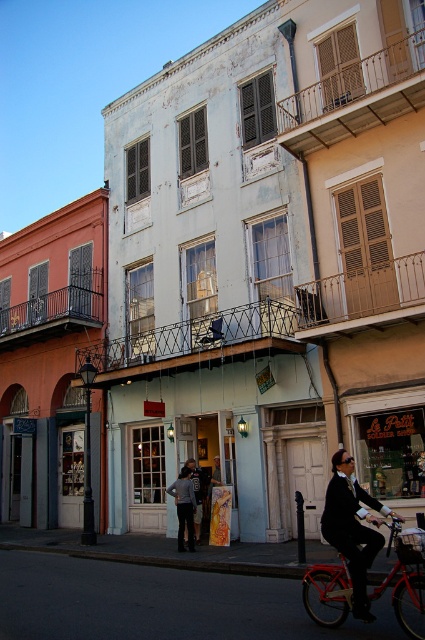
Question: Is metallic red bicycle at center to the right of matte black suit at lower right from the viewer's perspective?

Choices:
 (A) yes
 (B) no

Answer: (B)

Question: Which of the following is the farthest from the observer?

Choices:
 (A) metallic red bicycle at center
 (B) dark gray pants at center

Answer: (B)

Question: Can you confirm if metallic red bicycle at center is positioned to the left of matte black suit at lower right?

Choices:
 (A) no
 (B) yes

Answer: (B)

Question: Which point is closer to the camera taking this photo?

Choices:
 (A) (181, 486)
 (B) (353, 554)
 (C) (424, 616)

Answer: (C)

Question: Among these objects, which one is nearest to the camera?

Choices:
 (A) dark gray pants at center
 (B) metallic red bicycle at center
 (C) matte black suit at lower right

Answer: (B)

Question: Can you confirm if metallic red bicycle at center is smaller than dark gray pants at center?

Choices:
 (A) yes
 (B) no

Answer: (B)